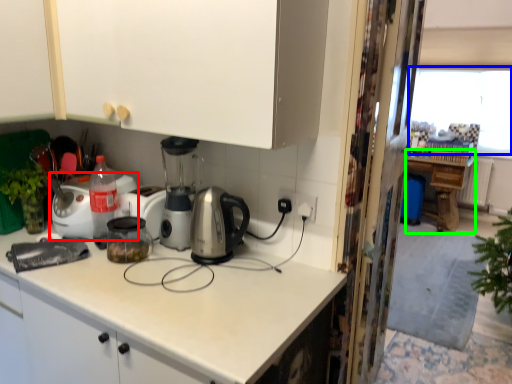
Question: Which is nearer to the home appliance (highlighted by a red box)? window screen (highlighted by a blue box) or table (highlighted by a green box).

Choices:
 (A) window screen
 (B) table

Answer: (B)